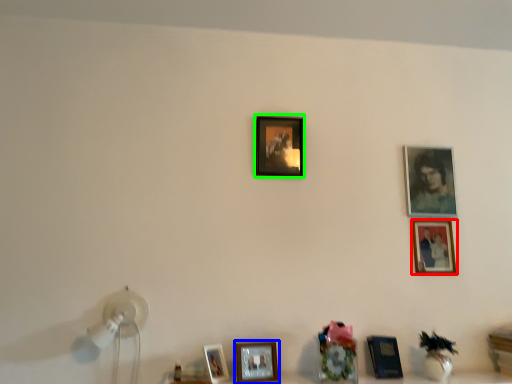
Question: Which object is positioned closest to picture frame (highlighted by a red box)? Select from picture frame (highlighted by a blue box) and picture frame (highlighted by a green box).

Choices:
 (A) picture frame
 (B) picture frame

Answer: (B)